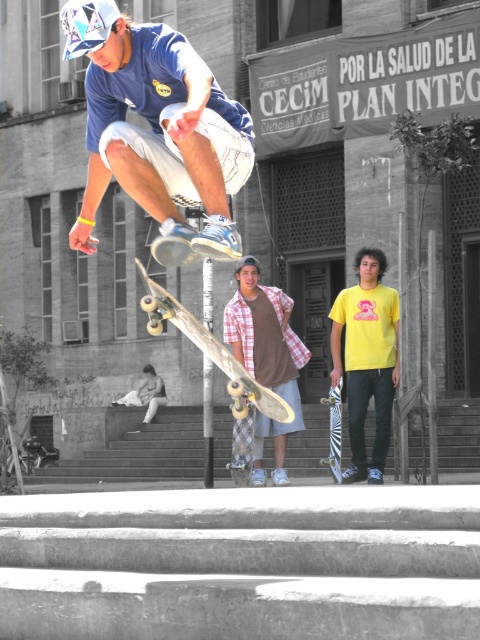
Question: Does matte blue shirt at upper center appear on the right side of wooden skateboard at center?

Choices:
 (A) no
 (B) yes

Answer: (A)

Question: Considering the real-world distances, which object is closest to the wooden skateboard at center?

Choices:
 (A) matte blue shirt at upper center
 (B) yellow matte shirt at center

Answer: (A)

Question: Which of the following is the closest to the observer?

Choices:
 (A) (336, 401)
 (B) (288, 333)
 (C) (141, 266)

Answer: (C)

Question: Which of these objects is positioned farthest from the matte blue shirt at upper center?

Choices:
 (A) zebra-patterned skateboard at center
 (B) plaid shirt at center

Answer: (A)

Question: Does matte blue shirt at upper center have a greater width compared to wooden skateboard at center?

Choices:
 (A) no
 (B) yes

Answer: (B)

Question: Is wooden skateboard at center to the right of zebra-patterned skateboard at center from the viewer's perspective?

Choices:
 (A) no
 (B) yes

Answer: (A)